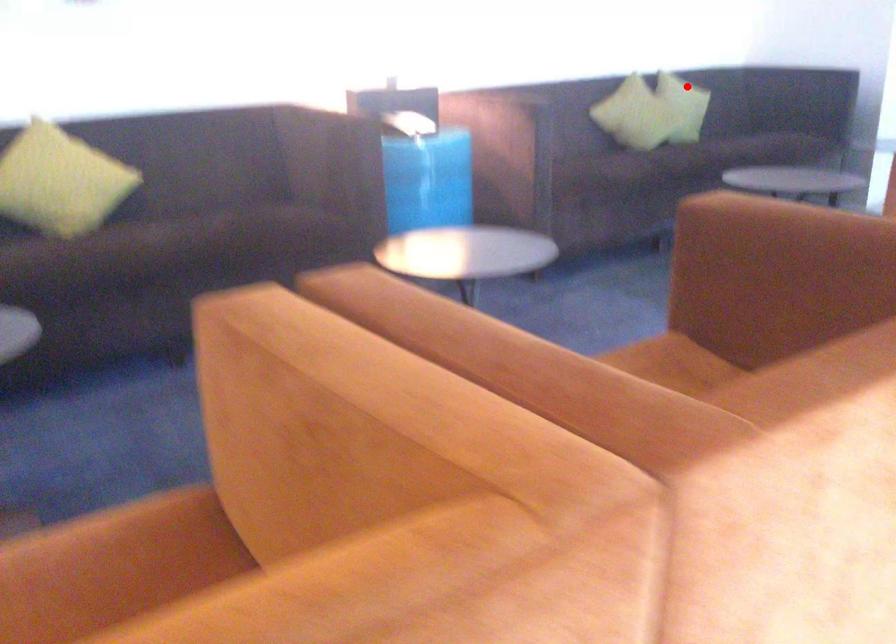
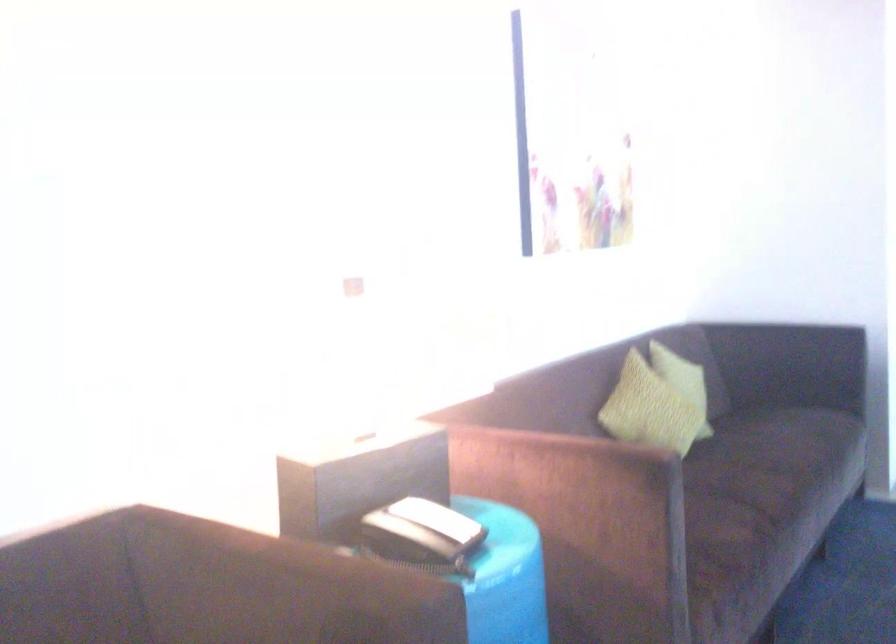
Question: I am providing you with two images of the same scene from different viewpoints. In image1, a red point is highlighted. Considering the same 3D point in image2, which of the following is correct?

Choices:
 (A) It is closer
 (B) It is farther

Answer: (A)